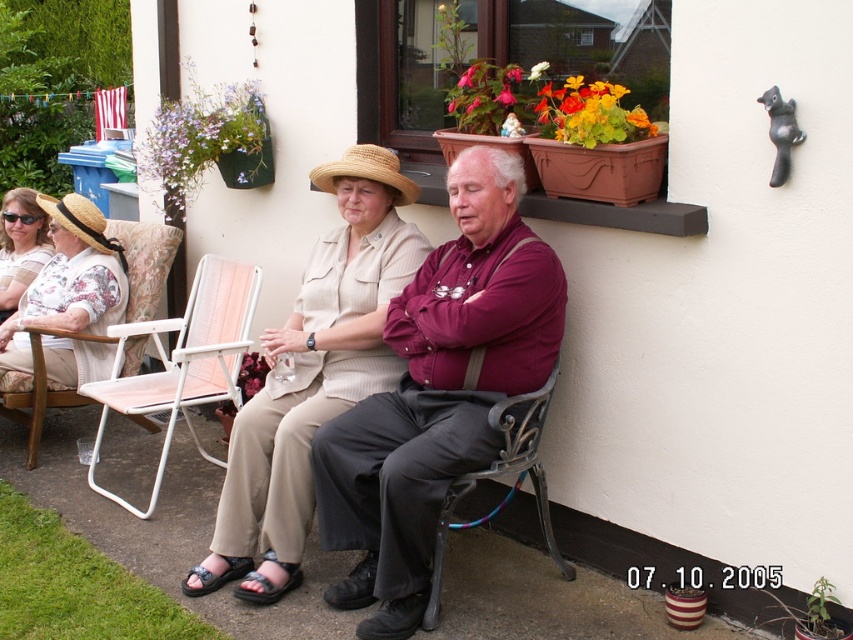
You are a delivery person who needs to place a small package on the white plastic chair at lower left without covering the strawhat at center. Is there enough space?

The white plastic chair at lower left has a larger size compared to strawhat at center, so there is enough space to place the small package without covering the strawhat at center.

You are standing in the garden and want to hand a gift to the person wearing the floral fabric blouse at left. Which direction should you approach from relative to the wooden chair at left?

The floral fabric blouse at left is to the left of the wooden chair at left, so you should approach from the left side of the wooden chair at left to reach the person wearing the floral fabric blouse at left.